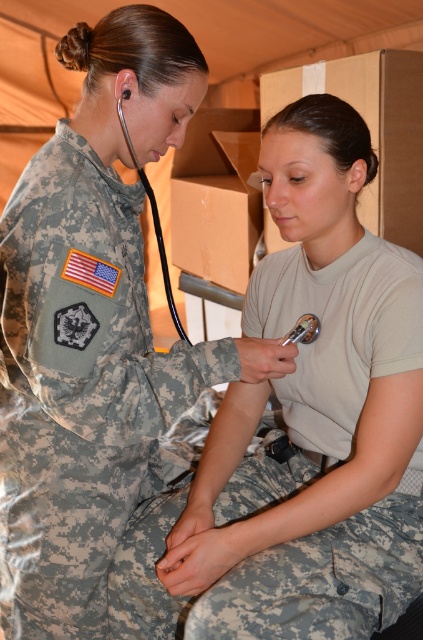
Question: Can you confirm if camouflage fabric uniform at upper left is bigger than camouflage fabric uniform at center?

Choices:
 (A) no
 (B) yes

Answer: (A)

Question: Is camouflage fabric uniform at upper left thinner than camouflage fabric uniform at center?

Choices:
 (A) no
 (B) yes

Answer: (B)

Question: Is camouflage fabric uniform at upper left smaller than camouflage fabric uniform at center?

Choices:
 (A) yes
 (B) no

Answer: (A)

Question: Which point is closer to the camera taking this photo?

Choices:
 (A) (153, 452)
 (B) (282, 282)

Answer: (A)

Question: Which object is farther from the camera taking this photo?

Choices:
 (A) camouflage fabric uniform at center
 (B) camouflage fabric uniform at upper left

Answer: (A)